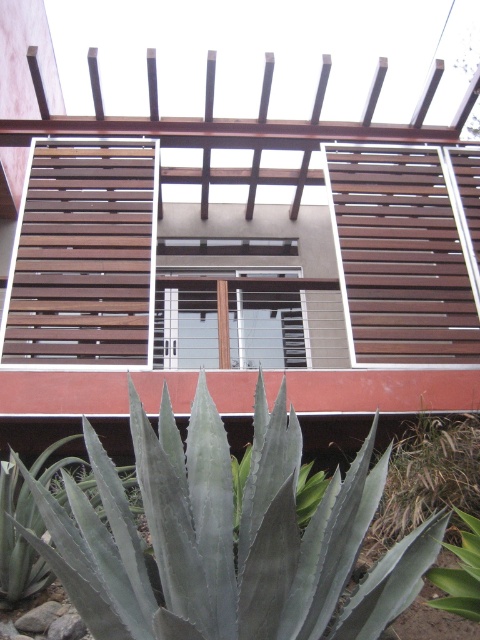
You are a gardener who needs to place a small decorative statue between the green leafy plant at lower right and the green succulent at lower center. Which plant should the statue be closer to if you want it to appear proportionally balanced with both?

The statue should be placed closer to the green succulent at lower center because the green leafy plant at lower right is larger in size, so balancing their sizes would require the statue to compensate by being nearer to the smaller plant.

You are standing in the modern architectural structure depicted in the scene. You need to water the green leafy plant at lower right. If your watering can has a maximum reach of 10 feet, will you be able to water it without moving closer?

The green leafy plant at lower right is 11.35 feet away from the viewer. Since the watering can only reaches up to 10 feet, you will need to move closer to water it.